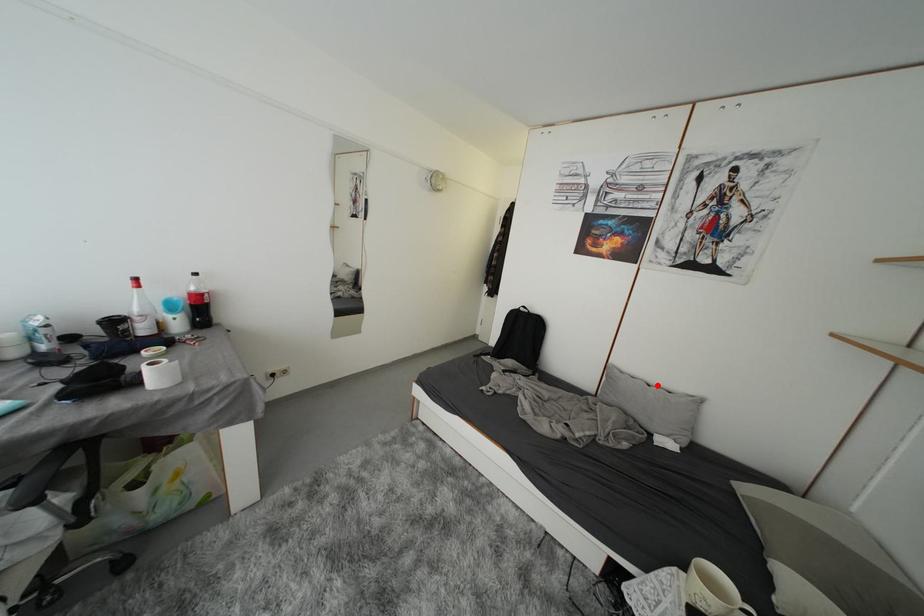
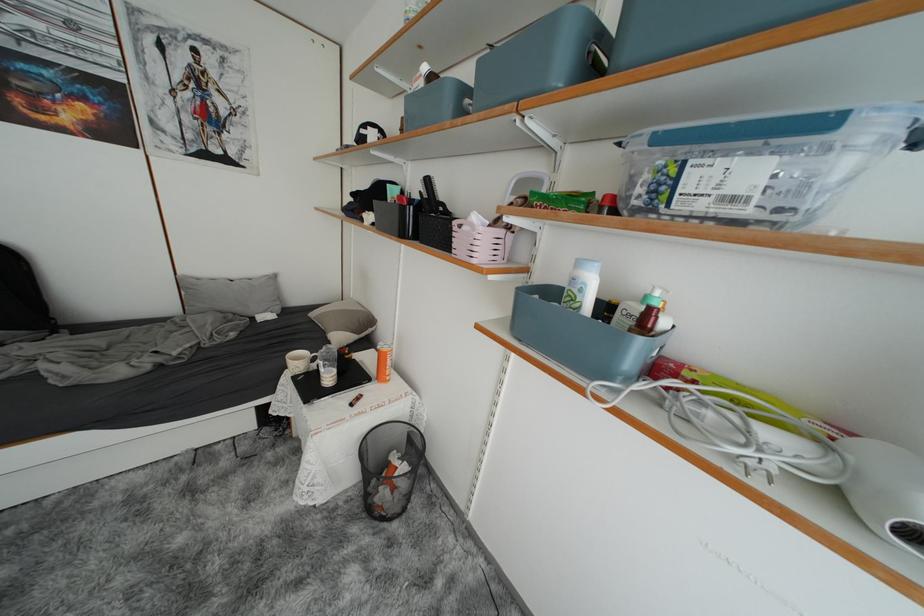
The point at the highlighted location is marked in the first image. Where is the corresponding point in the second image?

(238, 281)